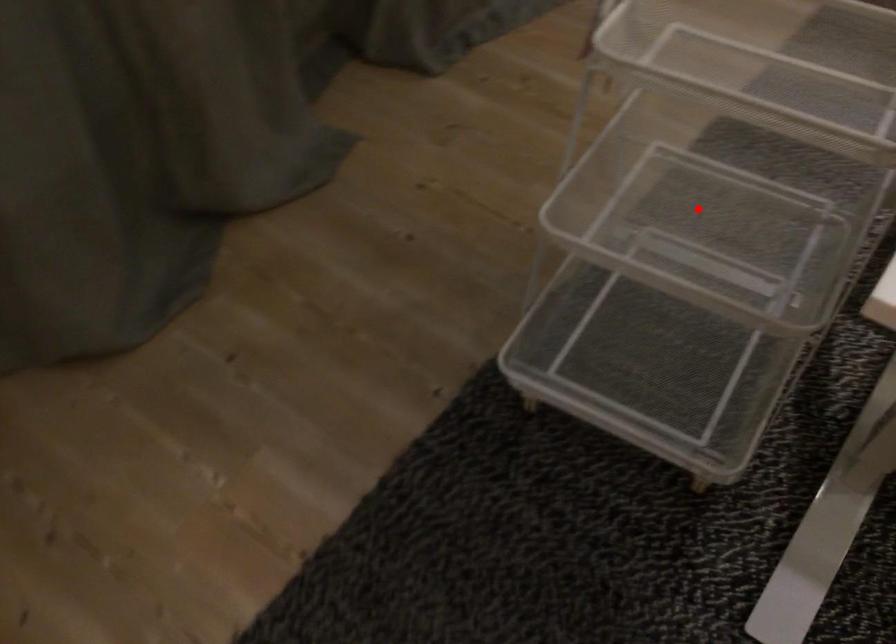
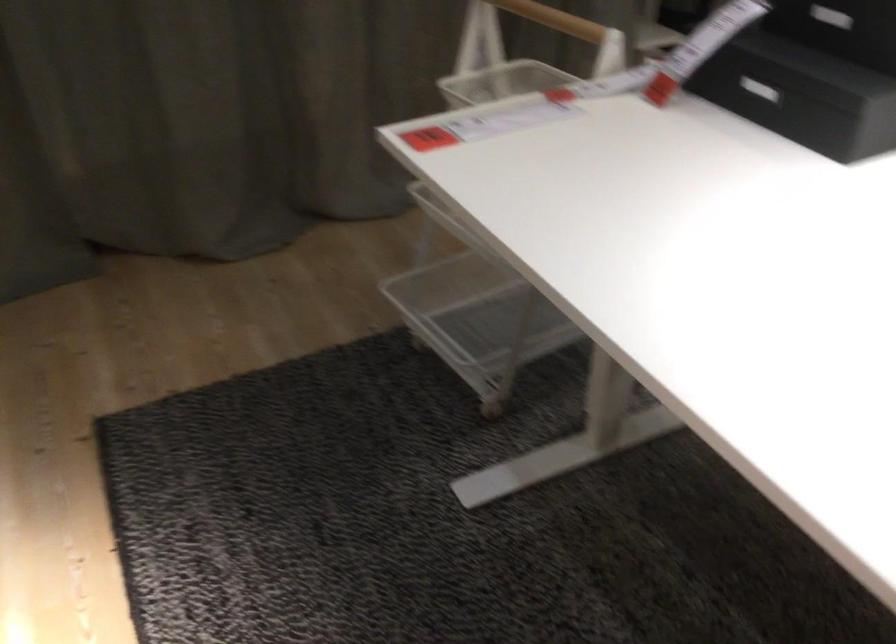
Question: I am providing you with two images of the same scene from different viewpoints. A red point is marked on the first image. At the location where the point appears in image 1, is it still visible in image 2?

Choices:
 (A) Yes
 (B) No

Answer: (B)